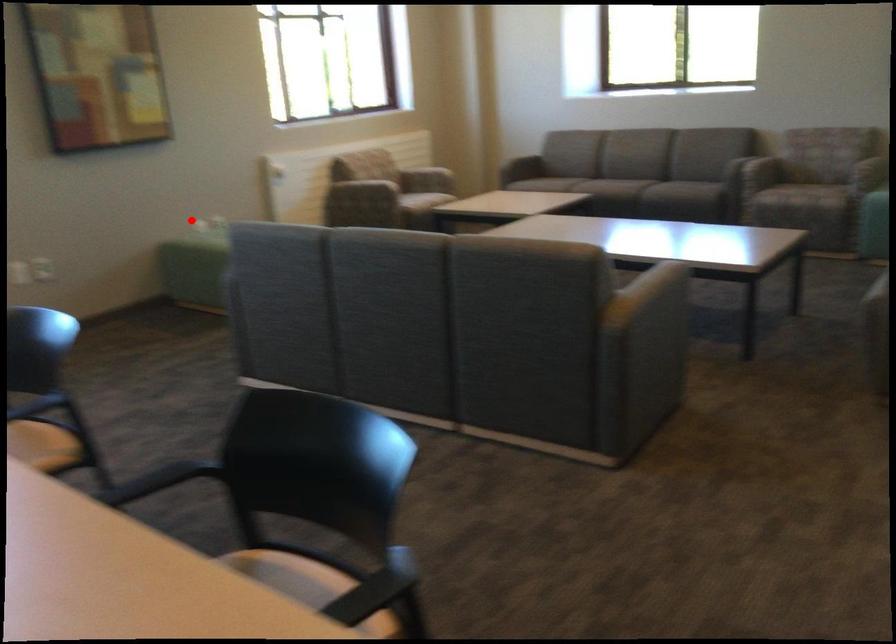
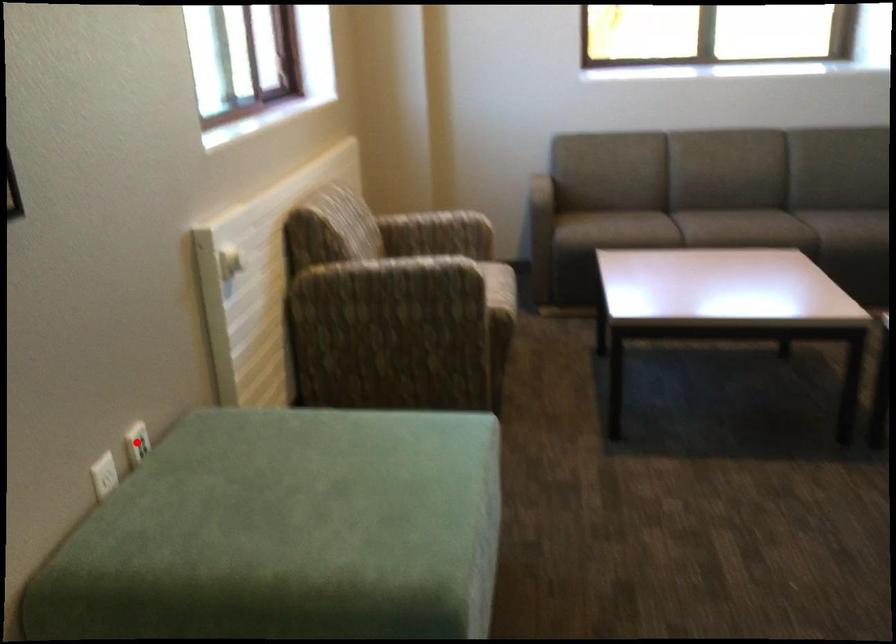
I am providing you with two images of the same scene from different viewpoints. A red point is marked on the first image and another point is marked on the second image. Does the point marked in image1 correspond to the same location as the one in image2?

No